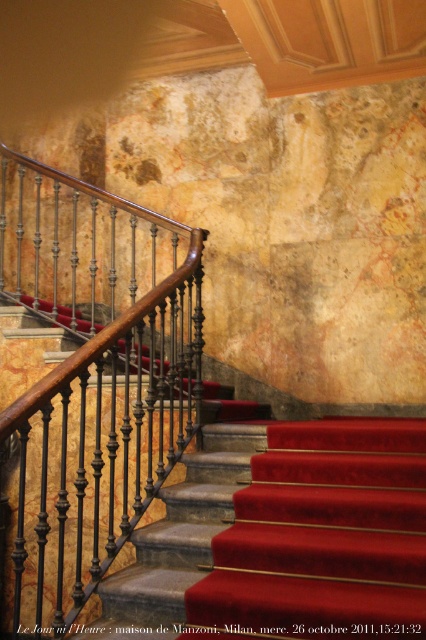
Question: Can you confirm if wooden polished handrail at center is positioned to the right of velvet red carpet at center?

Choices:
 (A) yes
 (B) no

Answer: (B)

Question: Which point appears closest to the camera in this image?

Choices:
 (A) (281, 545)
 (B) (28, 579)

Answer: (A)

Question: Considering the relative positions of wooden polished handrail at center and velvet red carpet at center in the image provided, where is wooden polished handrail at center located with respect to velvet red carpet at center?

Choices:
 (A) above
 (B) below

Answer: (A)

Question: Observing the image, what is the correct spatial positioning of wooden polished handrail at center in reference to velvet red carpet at center?

Choices:
 (A) below
 (B) above

Answer: (B)